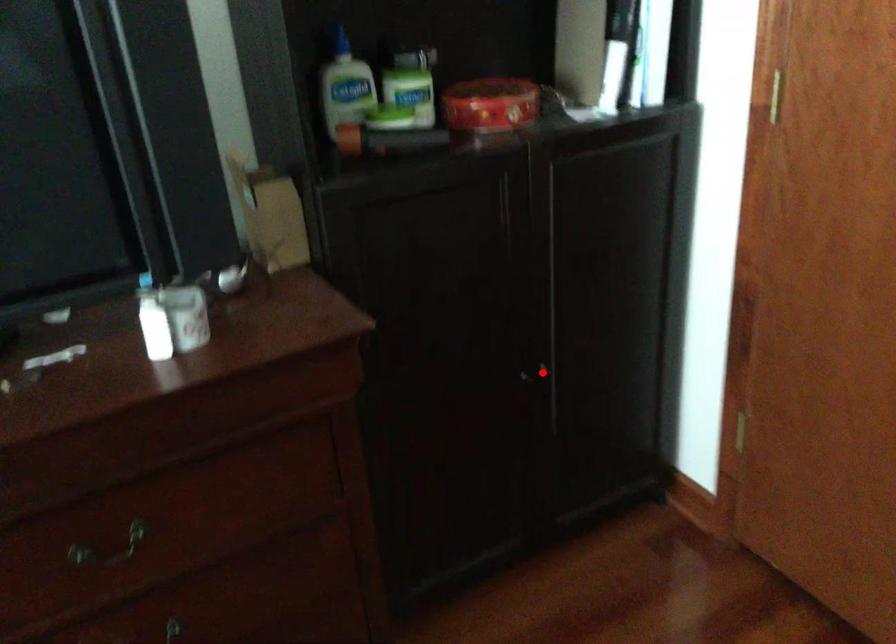
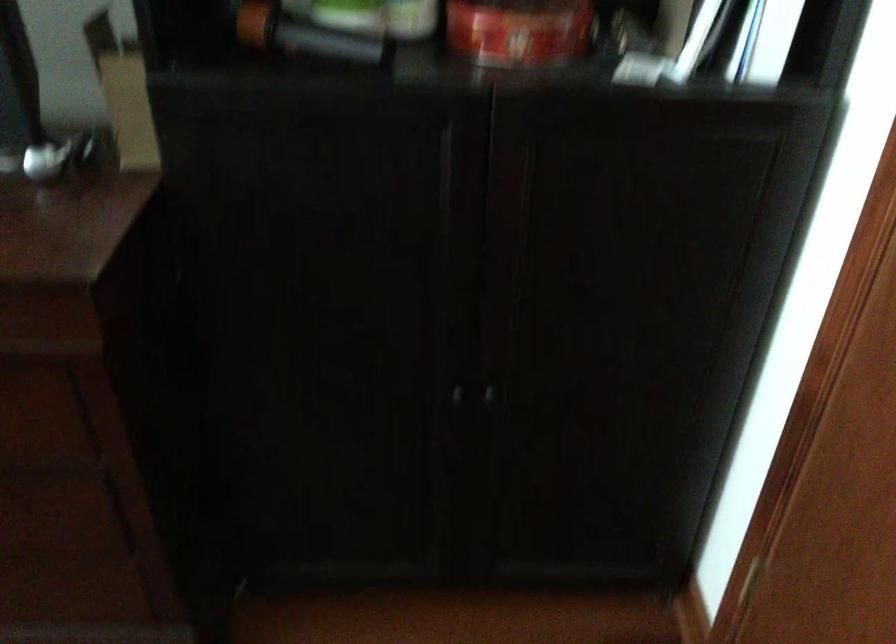
Question: A red point is marked in image1. In image2, is the corresponding 3D point closer to the camera or farther? Reply with the corresponding letter.

Choices:
 (A) The corresponding 3D point is closer.
 (B) The corresponding 3D point is farther.

Answer: (A)